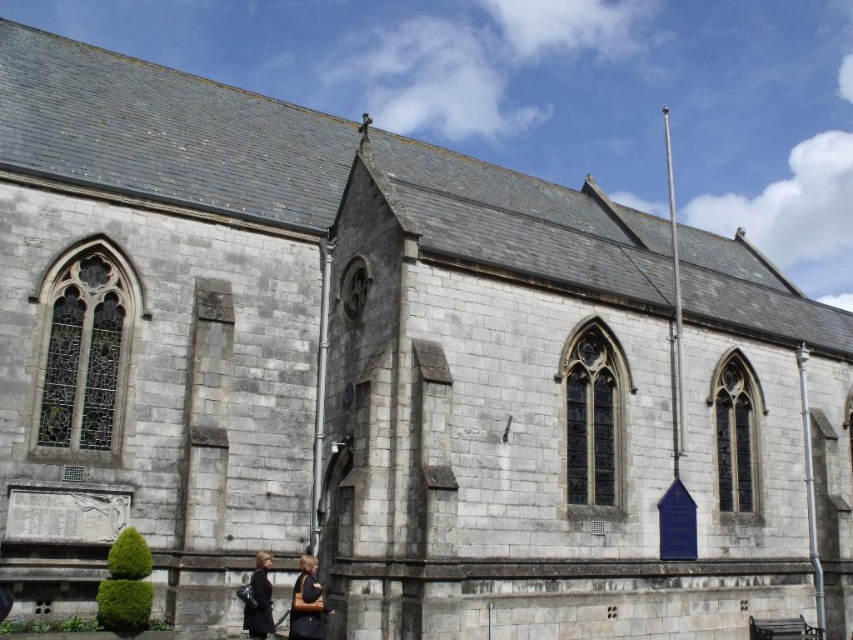
Question: Does dark brown leather jacket at lower center have a greater width compared to dark gray coat at lower center?

Choices:
 (A) yes
 (B) no

Answer: (B)

Question: Which object appears closest to the camera in this image?

Choices:
 (A) dark gray coat at lower center
 (B) dark brown leather jacket at lower center

Answer: (A)

Question: Is dark brown leather jacket at lower center to the right of dark gray coat at lower center from the viewer's perspective?

Choices:
 (A) yes
 (B) no

Answer: (A)

Question: Which of the following is the farthest from the observer?

Choices:
 (A) dark gray coat at lower center
 (B) dark brown leather jacket at lower center

Answer: (B)

Question: Does dark brown leather jacket at lower center have a greater width compared to dark gray coat at lower center?

Choices:
 (A) no
 (B) yes

Answer: (A)